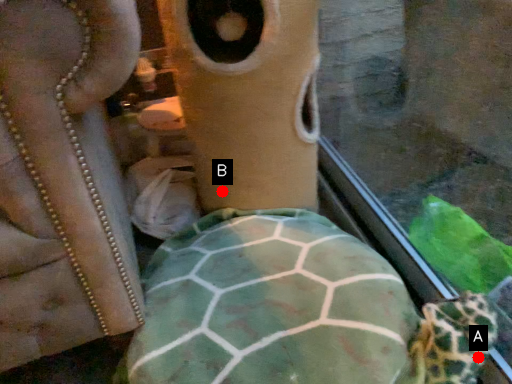
Question: Two points are circled on the image, labeled by A and B beside each circle. Which point is farther to the camera?

Choices:
 (A) A is further
 (B) B is further

Answer: (B)